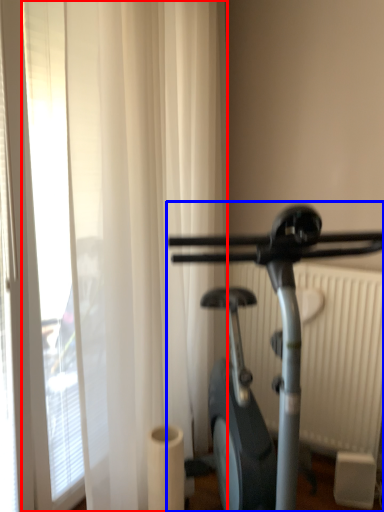
Question: Which point is closer to the camera, shower curtain (highlighted by a red box) or stationary bicycle (highlighted by a blue box)?

Choices:
 (A) shower curtain
 (B) stationary bicycle

Answer: (B)